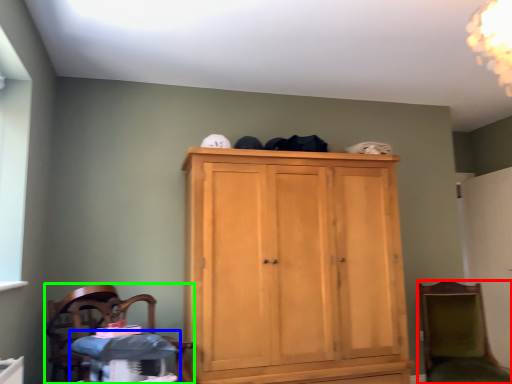
Question: Which object is the farthest from chair (highlighted by a red box)? Choose among these: changing table (highlighted by a blue box) or chair (highlighted by a green box).

Choices:
 (A) changing table
 (B) chair

Answer: (B)